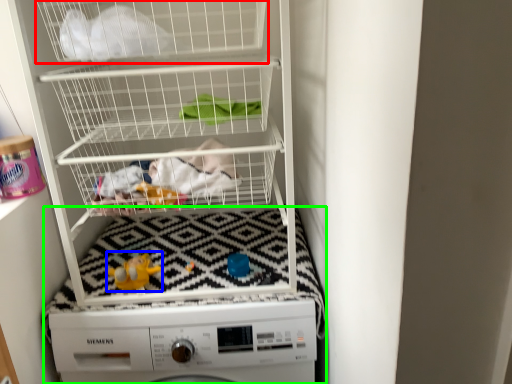
Question: Which is nearer to the shelf (highlighted by a red box)? toy (highlighted by a blue box) or machine (highlighted by a green box).

Choices:
 (A) toy
 (B) machine

Answer: (A)